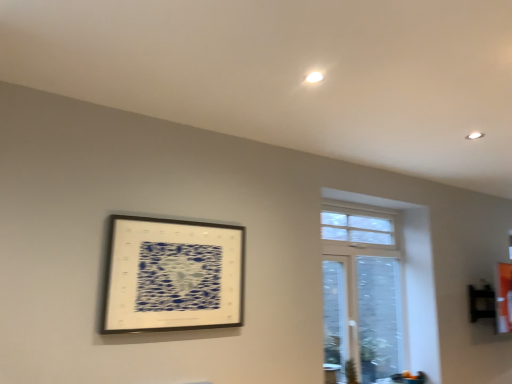
Question: From the image's perspective, is white glass window at upper right on top of metallic silver picture frame at upper left?

Choices:
 (A) no
 (B) yes

Answer: (A)

Question: Is white glass window at upper right taller than metallic silver picture frame at upper left?

Choices:
 (A) yes
 (B) no

Answer: (A)

Question: From a real-world perspective, is white glass window at upper right positioned under metallic silver picture frame at upper left based on gravity?

Choices:
 (A) yes
 (B) no

Answer: (A)

Question: From the image's perspective, is white glass window at upper right below metallic silver picture frame at upper left?

Choices:
 (A) no
 (B) yes

Answer: (B)

Question: Are white glass window at upper right and metallic silver picture frame at upper left beside each other?

Choices:
 (A) yes
 (B) no

Answer: (B)

Question: Is white glass window at upper right bigger than metallic silver picture frame at upper left?

Choices:
 (A) no
 (B) yes

Answer: (B)

Question: Can white glass window at upper right be found inside metallic silver picture frame at upper left?

Choices:
 (A) no
 (B) yes

Answer: (A)

Question: From a real-world perspective, is metallic silver picture frame at upper left physically above white glass window at upper right?

Choices:
 (A) yes
 (B) no

Answer: (A)

Question: Does metallic silver picture frame at upper left have a larger size compared to white glass window at upper right?

Choices:
 (A) yes
 (B) no

Answer: (B)

Question: Considering the relative sizes of metallic silver picture frame at upper left and white glass window at upper right in the image provided, is metallic silver picture frame at upper left smaller than white glass window at upper right?

Choices:
 (A) yes
 (B) no

Answer: (A)

Question: Is metallic silver picture frame at upper left positioned behind white glass window at upper right?

Choices:
 (A) yes
 (B) no

Answer: (B)

Question: Is metallic silver picture frame at upper left aimed at white glass window at upper right?

Choices:
 (A) no
 (B) yes

Answer: (A)

Question: Is white glass window at upper right in front of or behind metallic silver picture frame at upper left in the image?

Choices:
 (A) front
 (B) behind

Answer: (B)